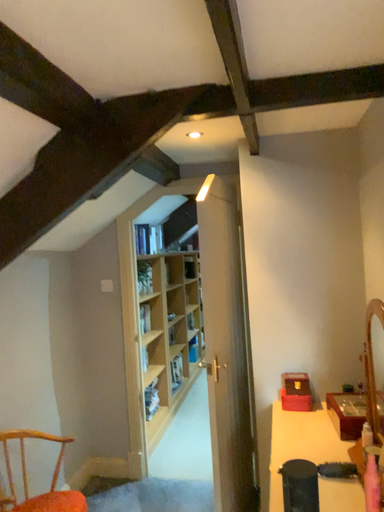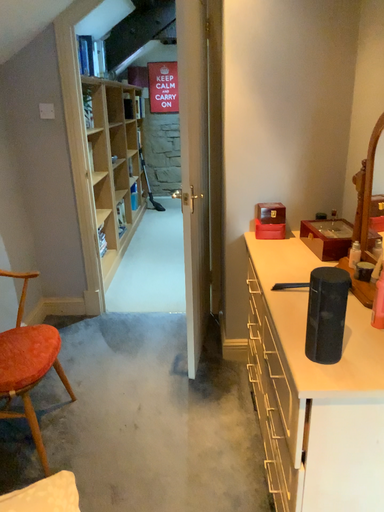
Question: Which way did the camera rotate in the video?

Choices:
 (A) rotated right
 (B) rotated left

Answer: (A)